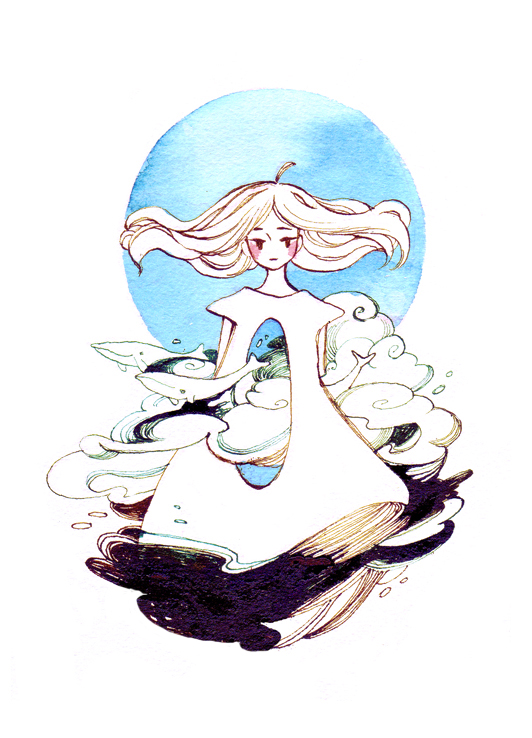
Find the location of a particular element. The height and width of the screenshot is (738, 532). art is located at coordinates (127, 462).